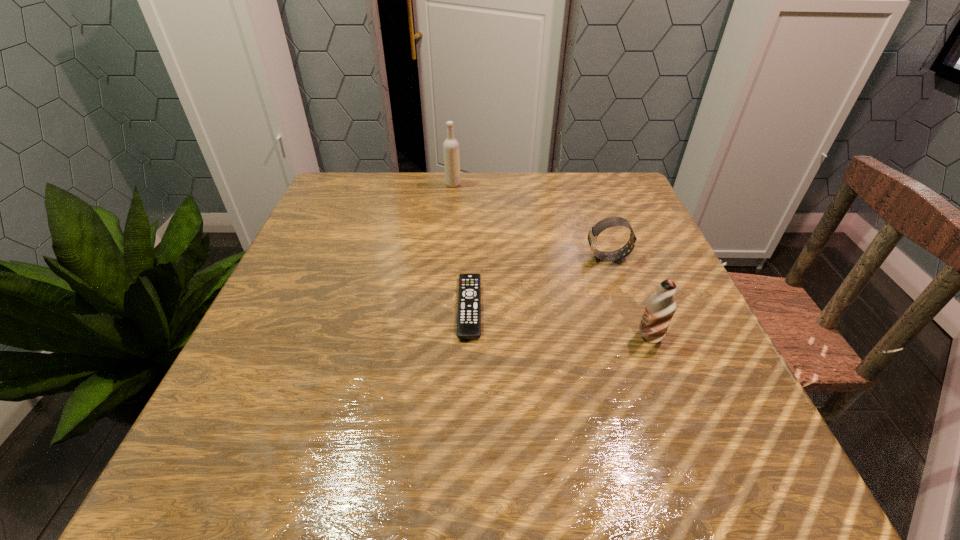
Find the location of a particular element. This screenshot has width=960, height=540. free space at the far left corner is located at coordinates (375, 193).

The width and height of the screenshot is (960, 540). Find the location of `free space at the far right corner of the desktop`. free space at the far right corner of the desktop is located at coordinates (577, 181).

Identify the location of free space between the second farthest object and the chocolate milk. (629, 297).

At what (x,y) coordinates should I click in order to perform the action: click on empty space between the chocolate milk and the remote control. Please return your answer as a coordinate pair (x, y). This screenshot has width=960, height=540. Looking at the image, I should click on (560, 322).

At what (x,y) coordinates should I click in order to perform the action: click on unoccupied position between the vodka and the chocolate milk. Please return your answer as a coordinate pair (x, y). The width and height of the screenshot is (960, 540). Looking at the image, I should click on (551, 261).

The height and width of the screenshot is (540, 960). Find the location of `empty space between the shortest object and the watch`. empty space between the shortest object and the watch is located at coordinates pos(539,282).

Locate an element on the screen. This screenshot has width=960, height=540. vacant space that is in between the watch and the leftmost object is located at coordinates (531, 221).

The image size is (960, 540). Identify the location of empty space that is in between the leftmost object and the shortest object. (461, 246).

Find the location of a particular element. This screenshot has height=540, width=960. vacant area between the vodka and the watch is located at coordinates (531, 221).

Find the location of a particular element. vacant area that lies between the chocolate milk and the third tallest object is located at coordinates (629, 297).